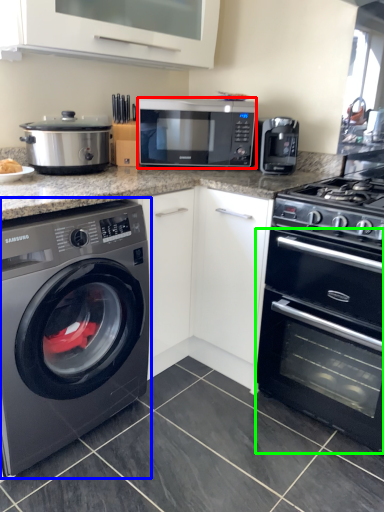
Question: Considering the real-world distances, which object is farthest from microwave oven (highlighted by a red box)? washing machine (highlighted by a blue box) or oven (highlighted by a green box)?

Choices:
 (A) washing machine
 (B) oven

Answer: (A)